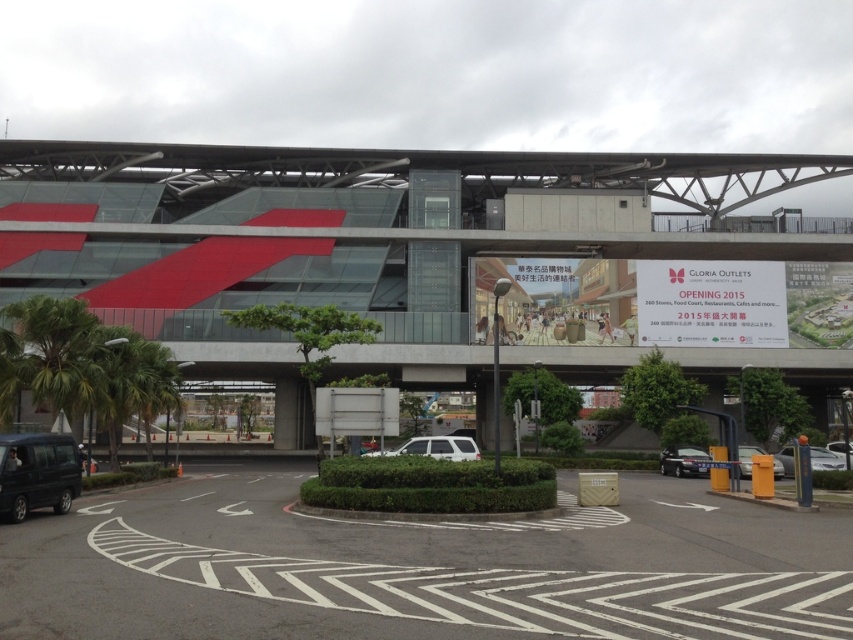
Based on the photo, does red glass building at center appear over metallic silver car at lower right?

Yes.

What do you see at coordinates (355, 225) in the screenshot? Image resolution: width=853 pixels, height=640 pixels. I see `red glass building at center` at bounding box center [355, 225].

At what (x,y) coordinates should I click in order to perform the action: click on red glass building at center. Please return your answer as a coordinate pair (x, y). The image size is (853, 640). Looking at the image, I should click on (355, 225).

Is point (74, 449) more distant than point (828, 444)?

No, it is in front of (828, 444).

You are a GUI agent. You are given a task and a screenshot of the screen. Output one action in this format:
    pyautogui.click(x=<x>, y=<y>)
    Task: Click on the matte black van at lower left
    Image resolution: width=853 pixels, height=640 pixels.
    Given the screenshot: What is the action you would take?
    pyautogui.click(x=38, y=474)

Is white matte suv at center smaller than metallic silver car at lower right?

No.

Locate an element on the screen. This screenshot has height=640, width=853. white matte suv at center is located at coordinates (434, 448).

Is point (415, 452) closer to viewer compared to point (746, 467)?

That is True.

Image resolution: width=853 pixels, height=640 pixels. In order to click on white matte suv at center in this screenshot , I will do `click(434, 448)`.